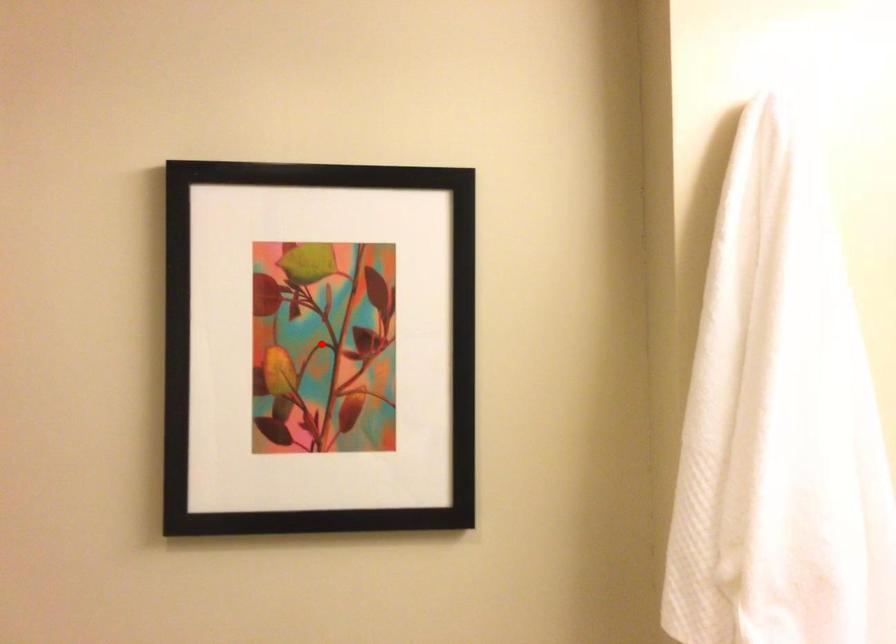
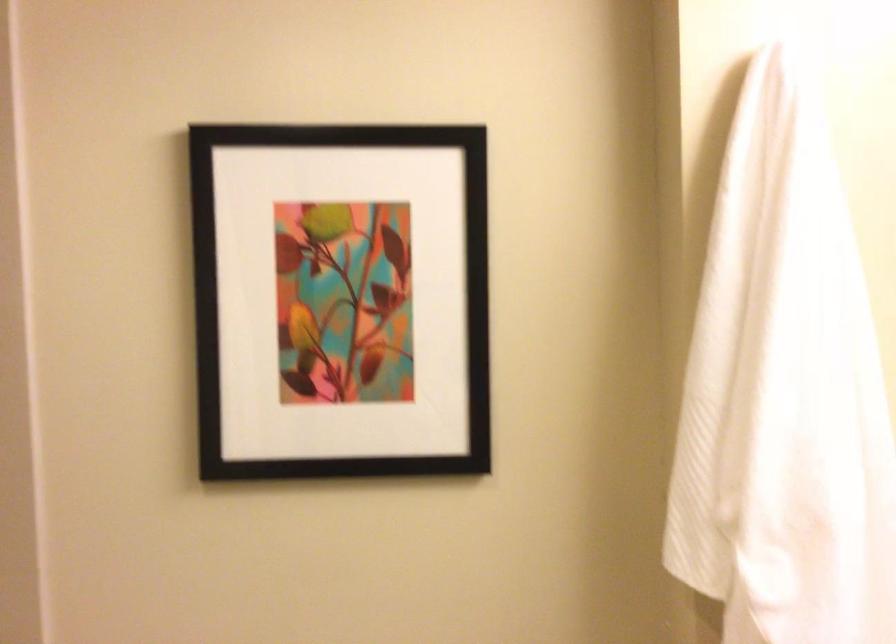
Find the pixel in the second image that matches the highlighted location in the first image.

(340, 299)